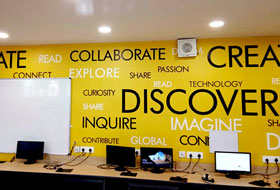
Locate an element on the screen. Image resolution: width=280 pixels, height=190 pixels. brown counter is located at coordinates (96, 166).